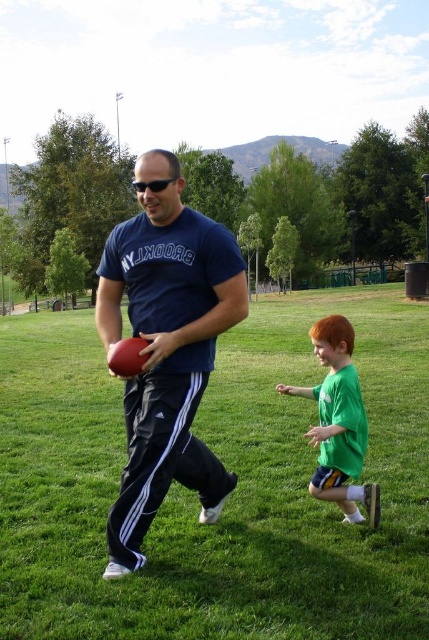
Question: Can you confirm if green grass at center is bigger than matte blue t-shirt at center?

Choices:
 (A) no
 (B) yes

Answer: (B)

Question: Is green grass at center bigger than green matte shirt at right?

Choices:
 (A) yes
 (B) no

Answer: (A)

Question: Which point is closer to the camera?

Choices:
 (A) (205, 600)
 (B) (340, 502)

Answer: (A)

Question: Which point is farther to the camera?

Choices:
 (A) (180, 624)
 (B) (180, 320)

Answer: (B)

Question: From the image, what is the correct spatial relationship of green grass at center in relation to matte blue t-shirt at center?

Choices:
 (A) below
 (B) above

Answer: (B)

Question: Estimate the real-world distances between objects in this image. Which object is farther from the matte blue t-shirt at center?

Choices:
 (A) green grass at center
 (B) green matte shirt at right

Answer: (A)